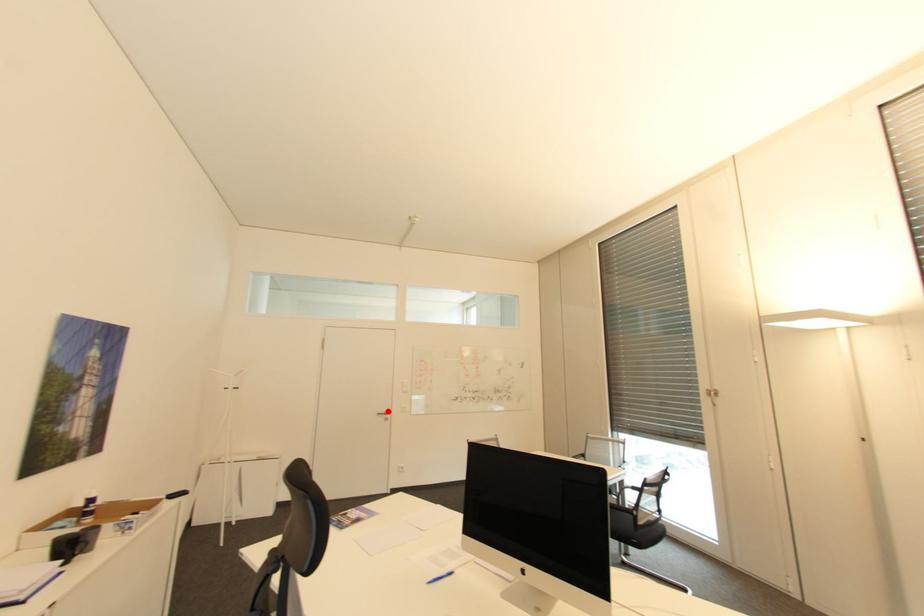
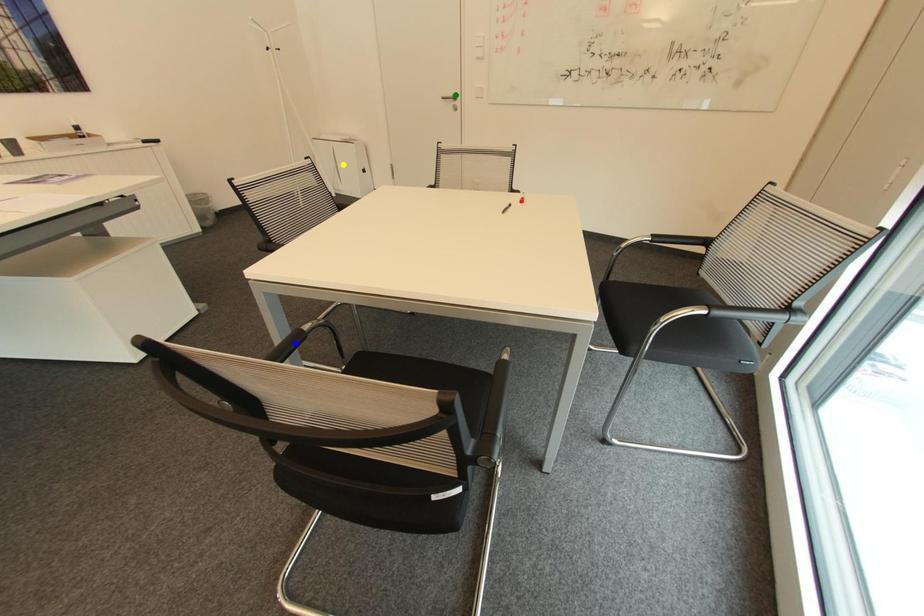
Question: I am providing you with two images of the same scene from different viewpoints. A red point is marked on the first image. You are given multiple points on the second image. Which point in image 2 is actually the same real-world point as the red point in image 1?

Choices:
 (A) blue point
 (B) yellow point
 (C) green point

Answer: (C)